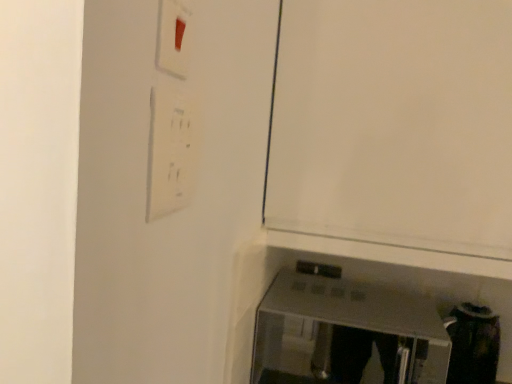
Question: From the image's perspective, is white matte door at center over white plastic light switch at upper left?

Choices:
 (A) yes
 (B) no

Answer: (A)

Question: Is white matte door at center behind white plastic light switch at upper left?

Choices:
 (A) yes
 (B) no

Answer: (A)

Question: Is white matte door at center looking in the opposite direction of white plastic light switch at upper left?

Choices:
 (A) no
 (B) yes

Answer: (A)

Question: Is white matte door at center facing towards white plastic light switch at upper left?

Choices:
 (A) no
 (B) yes

Answer: (B)

Question: Considering the relative sizes of white matte door at center and white plastic light switch at upper left in the image provided, is white matte door at center bigger than white plastic light switch at upper left?

Choices:
 (A) yes
 (B) no

Answer: (A)

Question: Is point (165, 117) positioned closer to the camera than point (285, 299)?

Choices:
 (A) closer
 (B) farther

Answer: (A)

Question: Based on their sizes in the image, would you say white plastic light switch at upper left is bigger or smaller than satin silver toaster at lower right?

Choices:
 (A) big
 (B) small

Answer: (B)

Question: Choose the correct answer: Is white plastic light switch at upper left inside satin silver toaster at lower right or outside it?

Choices:
 (A) outside
 (B) inside

Answer: (A)

Question: From the image's perspective, is white plastic light switch at upper left above or below satin silver toaster at lower right?

Choices:
 (A) below
 (B) above

Answer: (B)

Question: Is satin silver toaster at lower right inside the boundaries of white matte door at center, or outside?

Choices:
 (A) inside
 (B) outside

Answer: (B)

Question: From their relative heights in the image, would you say satin silver toaster at lower right is taller or shorter than white matte door at center?

Choices:
 (A) tall
 (B) short

Answer: (B)

Question: Is point (330, 334) closer or farther from the camera than point (391, 155)?

Choices:
 (A) closer
 (B) farther

Answer: (B)

Question: In the image, is satin silver toaster at lower right positioned in front of or behind white matte door at center?

Choices:
 (A) front
 (B) behind

Answer: (B)

Question: From the image's perspective, relative to satin silver toaster at lower right, is white matte door at center above or below?

Choices:
 (A) below
 (B) above

Answer: (B)

Question: Would you say white matte door at center is to the left or to the right of satin silver toaster at lower right in the picture?

Choices:
 (A) right
 (B) left

Answer: (A)